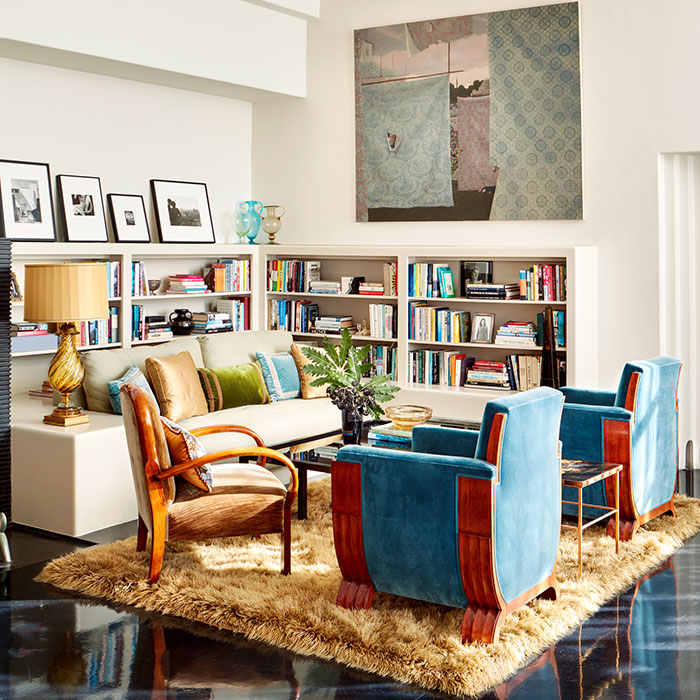
You are a GUI agent. You are given a task and a screenshot of the screen. Output one action in this format:
    pyautogui.click(x=<x>, y=<y>)
    Task: Click on the plant
    The height and width of the screenshot is (700, 700).
    Given the screenshot: What is the action you would take?
    pyautogui.click(x=354, y=407)